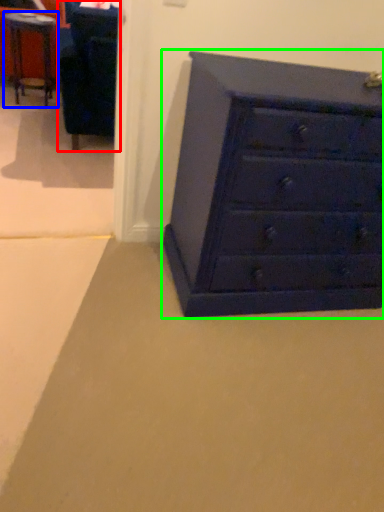
Question: Which object is positioned closest to furniture (highlighted by a red box)? Select from table (highlighted by a blue box) and chest of drawers (highlighted by a green box).

Choices:
 (A) table
 (B) chest of drawers

Answer: (A)